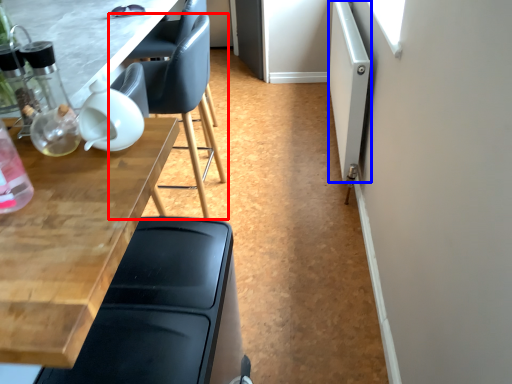
Question: Among these objects, which one is farthest to the camera, chair (highlighted by a red box) or screen door (highlighted by a blue box)?

Choices:
 (A) chair
 (B) screen door

Answer: (B)